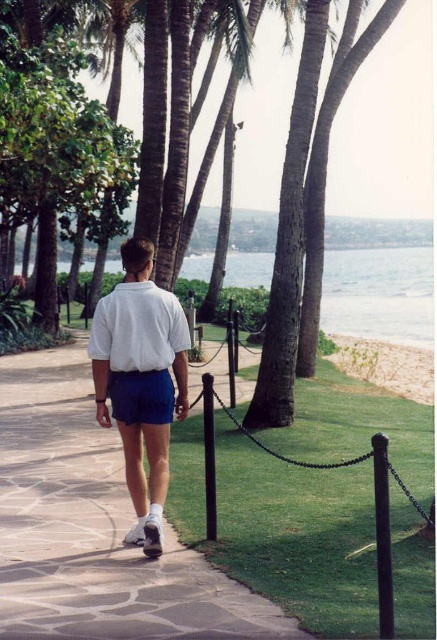
Question: Estimate the real-world distances between objects in this image. Which object is farther from the smooth stone pavement at center?

Choices:
 (A) white matte shirt at center
 (B) clear blue water at center

Answer: (B)

Question: Which of the following is the farthest from the observer?

Choices:
 (A) smooth stone pavement at center
 (B) white matte shirt at center
 (C) clear blue water at center

Answer: (C)

Question: Which of the following is the farthest from the observer?

Choices:
 (A) tap(125, 372)
 (B) tap(371, 252)

Answer: (B)

Question: Can you confirm if white matte shirt at center is positioned above clear blue water at center?

Choices:
 (A) yes
 (B) no

Answer: (B)

Question: Observing the image, what is the correct spatial positioning of smooth stone pavement at center in reference to white matte shirt at center?

Choices:
 (A) right
 (B) left

Answer: (B)

Question: Is white matte shirt at center to the right of clear blue water at center from the viewer's perspective?

Choices:
 (A) no
 (B) yes

Answer: (A)